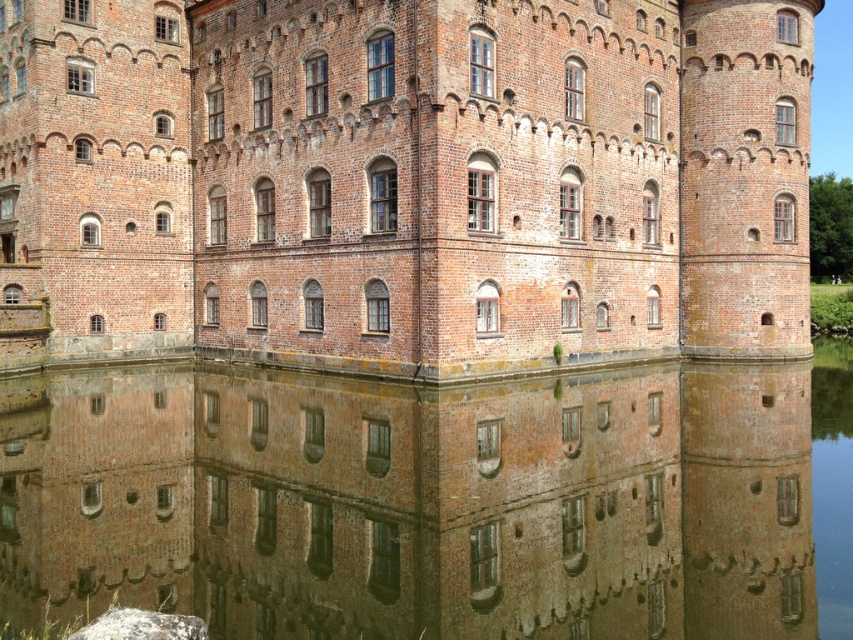
You are an architect analyzing the castle design. The brick wall at center and brown reflective water at bottom are both part of the scene. Which object occupies a larger area in the image?

The brick wall at center has a larger size compared to the brown reflective water at bottom, so the brick wall at center occupies a larger area in the image.

You are standing in front of the castle and want to take a photo that includes both the brick wall at center and the brown reflective water at bottom. Which object will appear closer to you in the photo?

The brick wall at center will appear closer to you in the photo because it is positioned further to the viewer than the brown reflective water at bottom, making it seem nearer in the image.